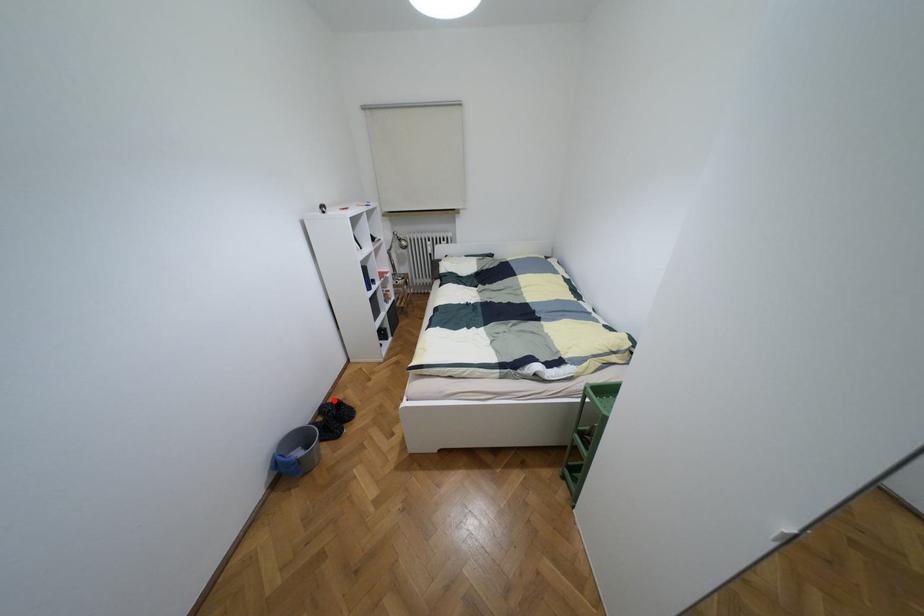
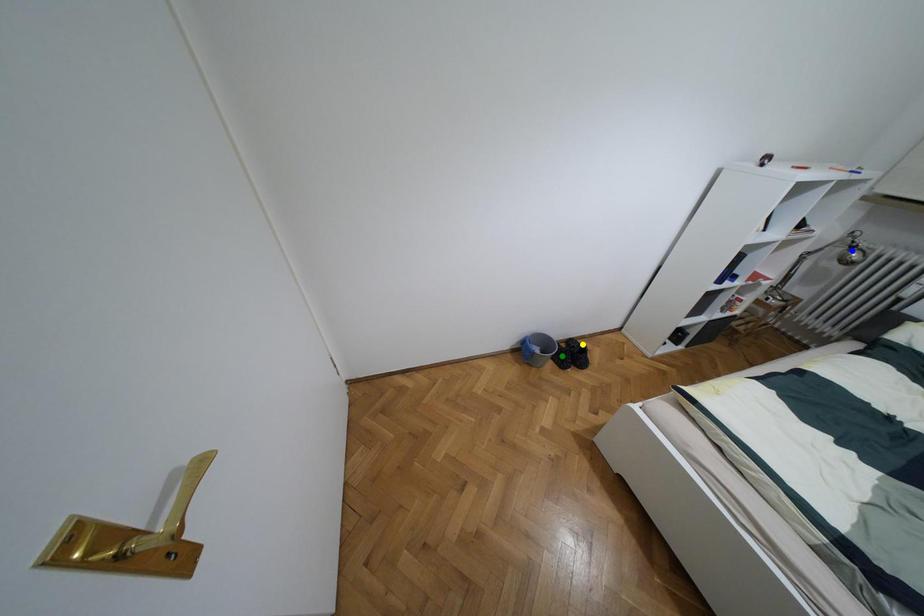
Question: I am providing you with two images of the same scene from different viewpoints. A red point is marked on the first image. You are given multiple points on the second image. Which point in image 2 is actually the same real-world point as the red point in image 1?

Choices:
 (A) blue point
 (B) yellow point
 (C) green point

Answer: (B)